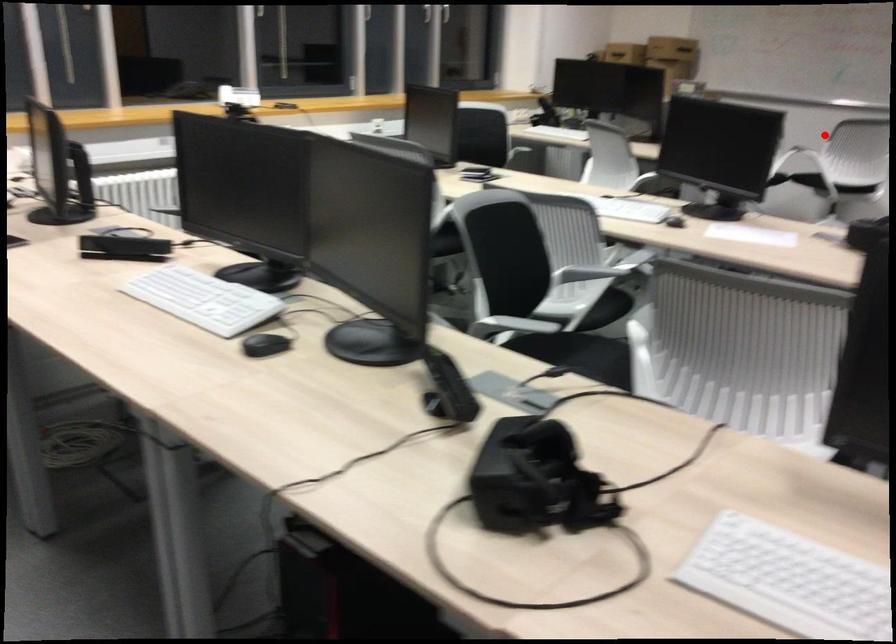
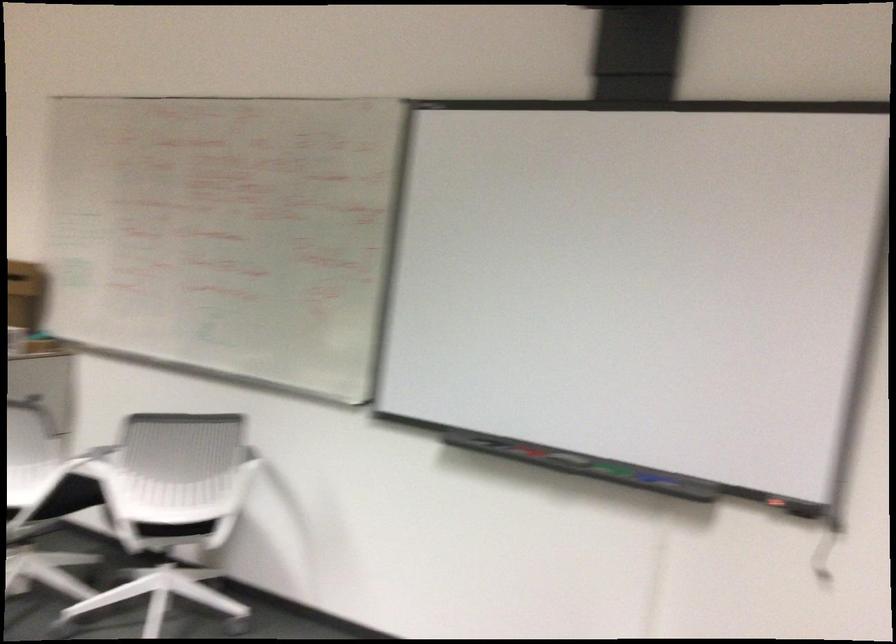
Find the pixel in the second image that matches the highlighted location in the first image.

(95, 460)